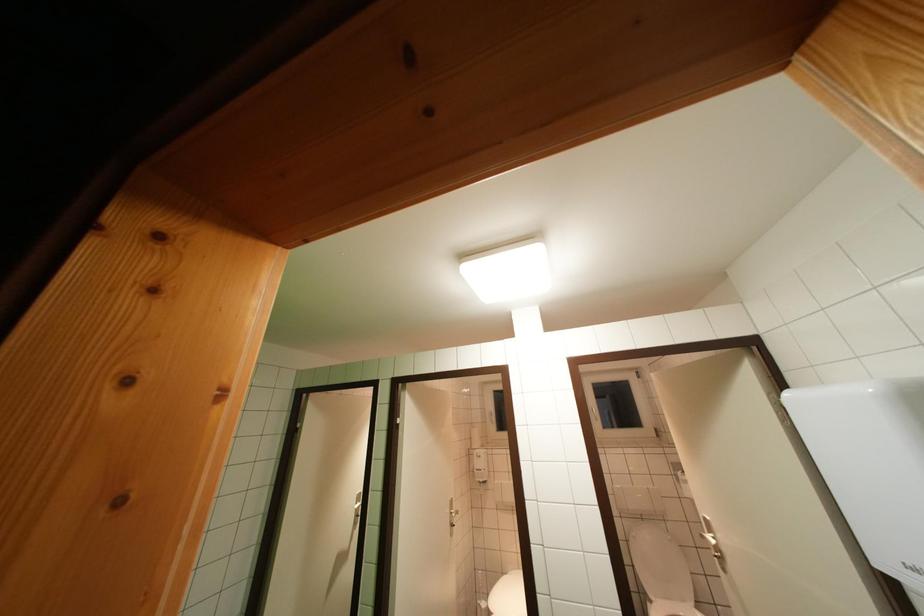
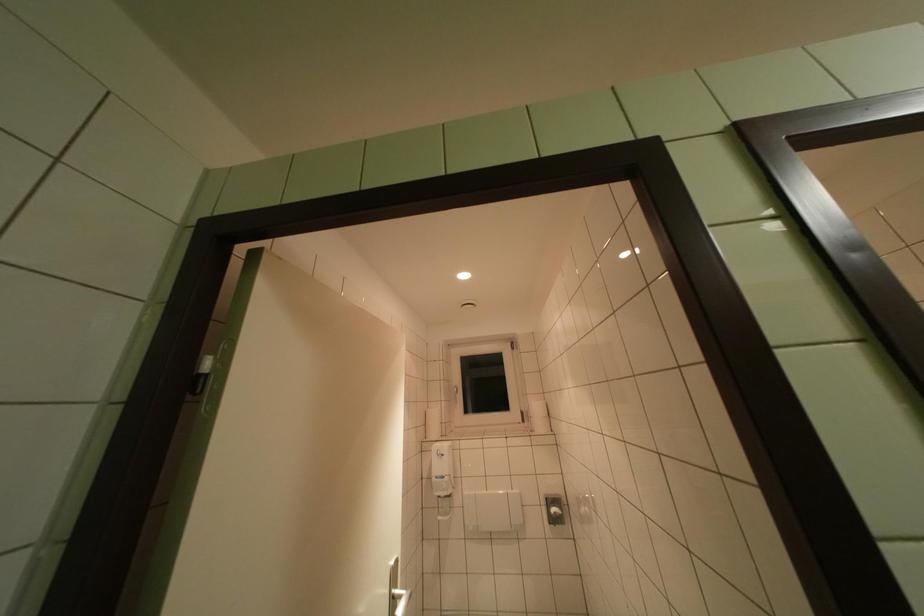
Based on the photo, the images are taken continuously from a first-person perspective. In which direction are you moving?

The movement direction of the cameraman is left, forward.